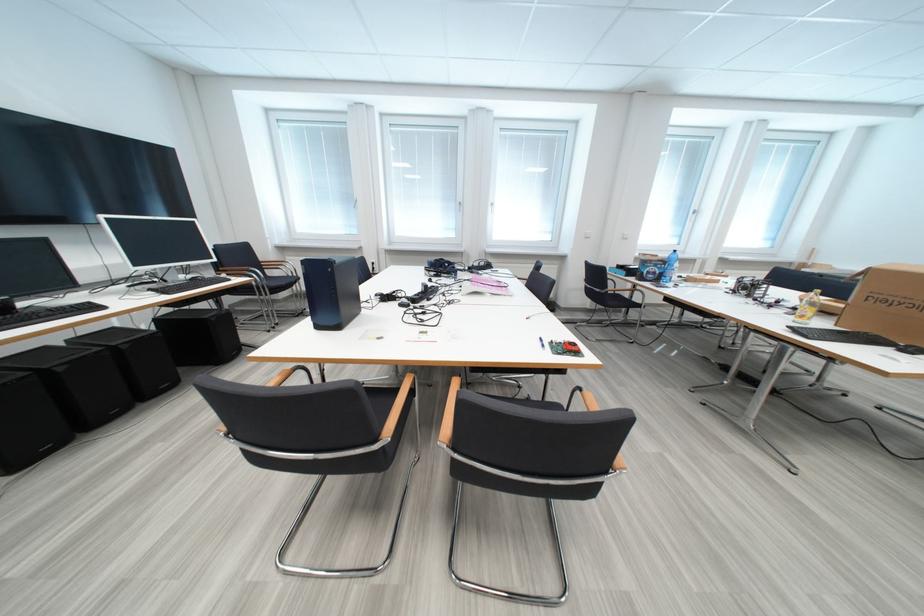
Identify the location of yellow juice bottle. (807, 307).